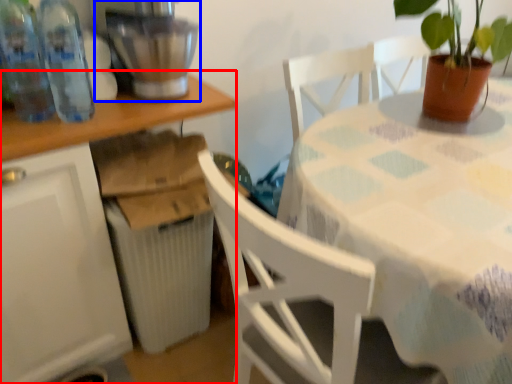
Question: Which object appears closest to the camera in this image, table (highlighted by a red box) or mixer (highlighted by a blue box)?

Choices:
 (A) table
 (B) mixer

Answer: (A)